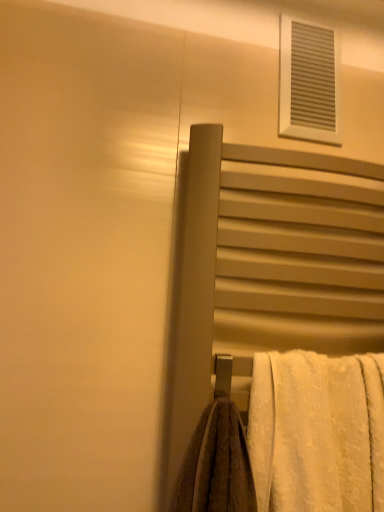
Question: Is white fluffy towel at lower right behind white textured vent at upper right?

Choices:
 (A) yes
 (B) no

Answer: (B)

Question: From a real-world perspective, is white fluffy towel at lower right on white textured vent at upper right?

Choices:
 (A) no
 (B) yes

Answer: (A)

Question: Considering the relative sizes of white fluffy towel at lower right and white textured vent at upper right in the image provided, is white fluffy towel at lower right taller than white textured vent at upper right?

Choices:
 (A) yes
 (B) no

Answer: (A)

Question: Does white fluffy towel at lower right have a larger size compared to white textured vent at upper right?

Choices:
 (A) yes
 (B) no

Answer: (A)

Question: Is white fluffy towel at lower right positioned with its back to white textured vent at upper right?

Choices:
 (A) yes
 (B) no

Answer: (B)

Question: Would you say white fluffy towel at lower right is outside white textured vent at upper right?

Choices:
 (A) no
 (B) yes

Answer: (B)

Question: From a real-world perspective, is white fluffy towel at lower right over matte gray towel rack at center-right?

Choices:
 (A) yes
 (B) no

Answer: (B)

Question: From the image's perspective, is white fluffy towel at lower right located above matte gray towel rack at center-right?

Choices:
 (A) yes
 (B) no

Answer: (B)

Question: Is white fluffy towel at lower right positioned far away from matte gray towel rack at center-right?

Choices:
 (A) no
 (B) yes

Answer: (A)

Question: From a real-world perspective, is white fluffy towel at lower right below matte gray towel rack at center-right?

Choices:
 (A) yes
 (B) no

Answer: (A)

Question: Does white fluffy towel at lower right appear on the left side of matte gray towel rack at center-right?

Choices:
 (A) yes
 (B) no

Answer: (B)

Question: From the image's perspective, does white fluffy towel at lower right appear lower than matte gray towel rack at center-right?

Choices:
 (A) yes
 (B) no

Answer: (A)

Question: Is matte gray towel rack at center-right further to camera compared to white textured vent at upper right?

Choices:
 (A) yes
 (B) no

Answer: (B)